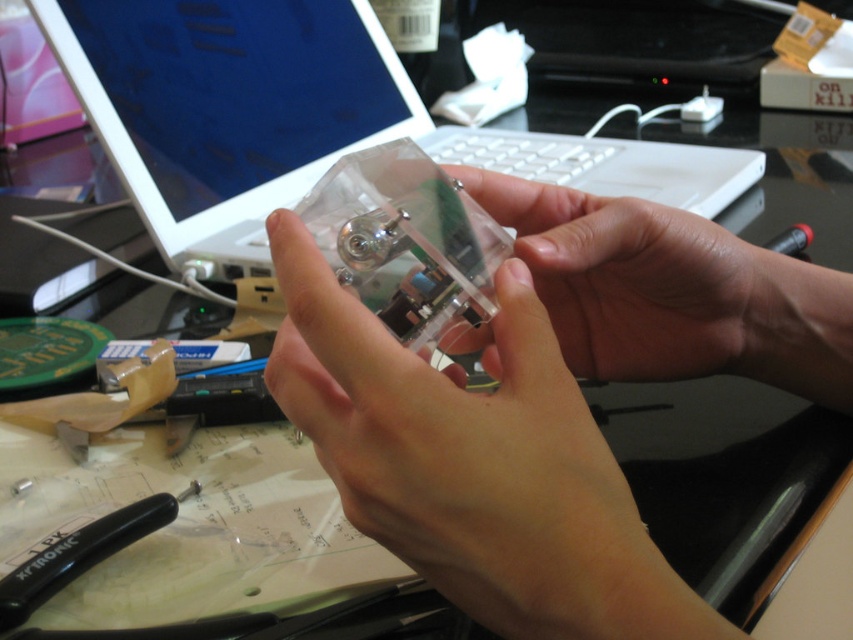
You are a technician working on a desk. You need to place a tool on the transparent plastic object at center. Is there enough space to place it?

The transparent plastic object at center is located at point [544,401]. Since the object is transparent, you can see the space around it. However, the desk is cluttered with items like a laptop, green circular object, black tool, and scattered papers. Without knowing the exact size of the tool and the available space on the transparent plastic object at center, it is impossible to determine if there is enough space. Please check the dimensions of both the tool and the object.

You are a technician working on a desk. You need to place a ruler next to the transparent plastic object at center so that it can be measured. Since the ruler is 12 inches long, will the entire ruler fit within the camera frame if placed next to the object?

The transparent plastic object at center is 9.33 inches away from camera. Since the ruler is 12 inches long, placing it next to the object would require the camera to capture at least 12 inches in the frame. However, the distance from the object to the camera does not directly indicate the field of view. Without knowing the camera angle or field of view, it is impossible to determine if the entire ruler will fit. Please adjust the camera position or angle for a clearer view.